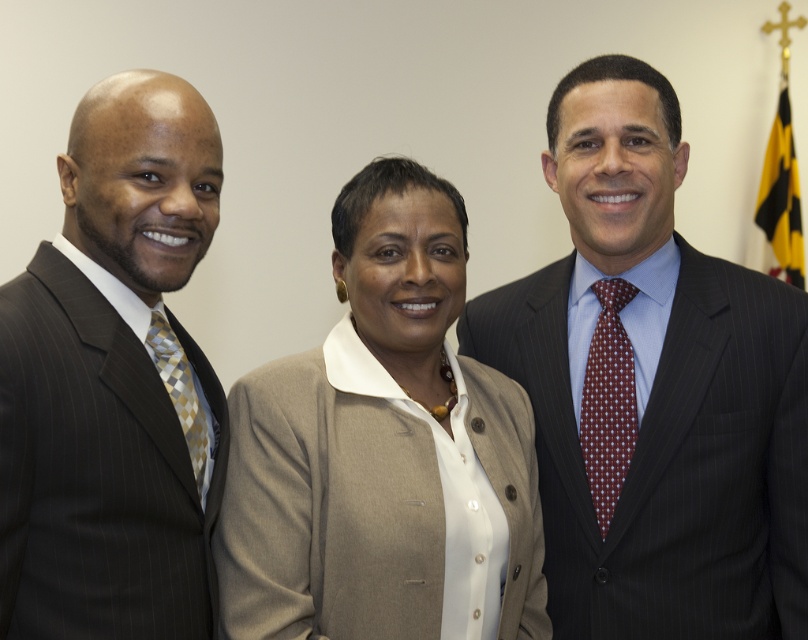
Question: Is matte black suit at left positioned behind maroon dotted tie at right?

Choices:
 (A) no
 (B) yes

Answer: (A)

Question: Does matte black suit at left have a greater width compared to yellow/black fabric flag at upper right?

Choices:
 (A) no
 (B) yes

Answer: (B)

Question: Which point appears closest to the camera in this image?

Choices:
 (A) (222, 404)
 (B) (722, 284)

Answer: (A)

Question: Which object is the farthest from the matte black suit at left?

Choices:
 (A) gold checkered tie at left
 (B) maroon dotted tie at right
 (C) beige fabric jacket at center
 (D) dark pinstripe suit at center

Answer: (B)

Question: Does dark pinstripe suit at center have a larger size compared to matte black suit at left?

Choices:
 (A) no
 (B) yes

Answer: (B)

Question: Which point is farther to the camera?

Choices:
 (A) beige fabric jacket at center
 (B) dark pinstripe suit at center

Answer: (B)